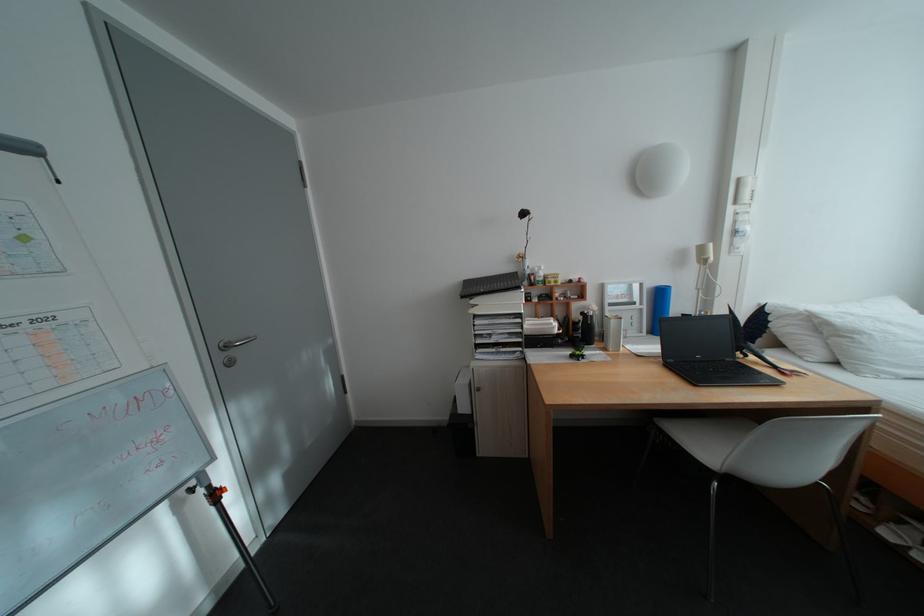
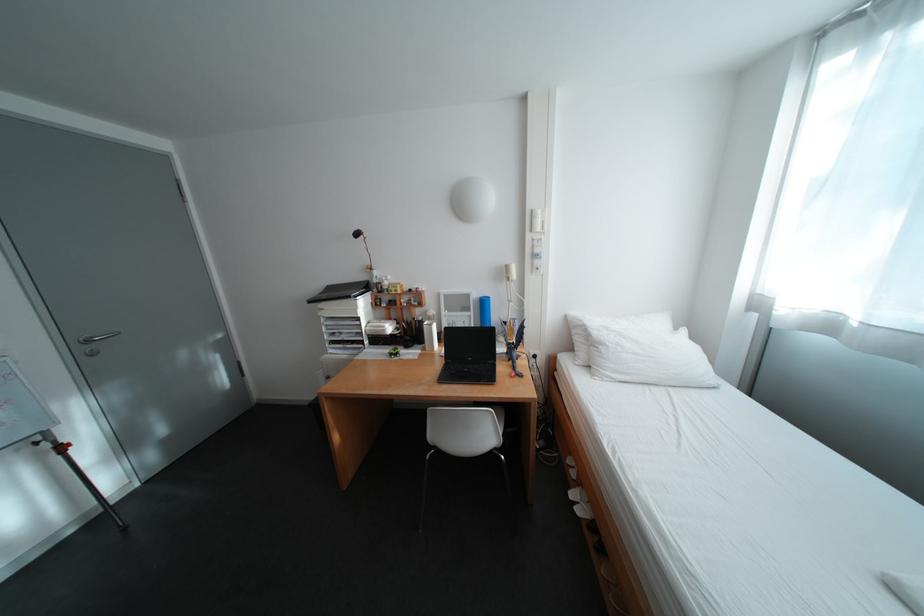
Locate, in the second image, the point that corresponds to (x=751, y=180) in the first image.

(544, 213)